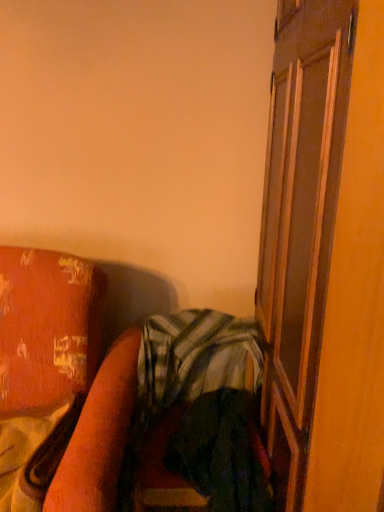
Question: Is wooden bed frame at lower left turned away from green striped fabric at center?

Choices:
 (A) yes
 (B) no

Answer: (B)

Question: Does wooden bed frame at lower left have a larger size compared to green striped fabric at center?

Choices:
 (A) yes
 (B) no

Answer: (A)

Question: Is wooden bed frame at lower left aimed at green striped fabric at center?

Choices:
 (A) no
 (B) yes

Answer: (A)

Question: Does wooden bed frame at lower left lie behind green striped fabric at center?

Choices:
 (A) no
 (B) yes

Answer: (A)

Question: From the image's perspective, is wooden bed frame at lower left under green striped fabric at center?

Choices:
 (A) yes
 (B) no

Answer: (A)

Question: From a real-world perspective, is wooden bed frame at lower left located higher than green striped fabric at center?

Choices:
 (A) yes
 (B) no

Answer: (B)

Question: Is wooden bed frame at lower left completely or partially outside of brown wooden screen door at right?

Choices:
 (A) yes
 (B) no

Answer: (A)

Question: Is wooden bed frame at lower left to the right of brown wooden screen door at right from the viewer's perspective?

Choices:
 (A) no
 (B) yes

Answer: (A)

Question: Can you confirm if wooden bed frame at lower left is wider than brown wooden screen door at right?

Choices:
 (A) no
 (B) yes

Answer: (B)

Question: Is wooden bed frame at lower left not close to brown wooden screen door at right?

Choices:
 (A) yes
 (B) no

Answer: (B)

Question: Would you say brown wooden screen door at right is part of wooden bed frame at lower left's contents?

Choices:
 (A) no
 (B) yes

Answer: (A)

Question: From the image's perspective, is wooden bed frame at lower left under brown wooden screen door at right?

Choices:
 (A) no
 (B) yes

Answer: (B)

Question: From the image's perspective, would you say brown wooden screen door at right is positioned over wooden bed frame at lower left?

Choices:
 (A) yes
 (B) no

Answer: (A)